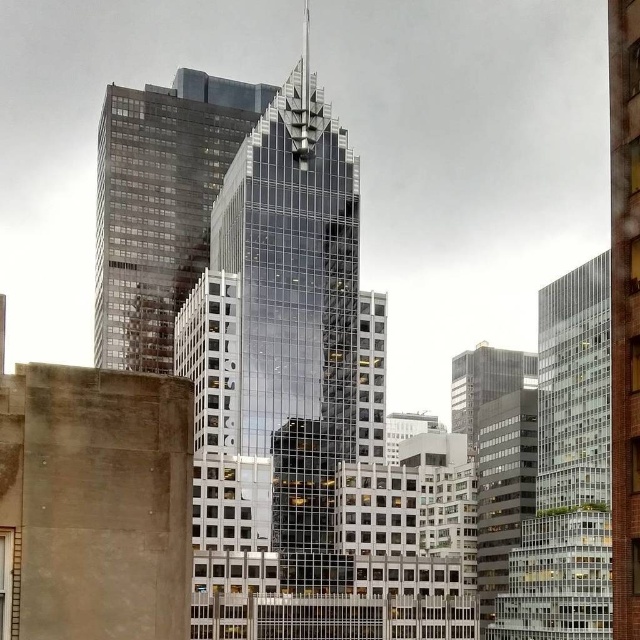
Question: From the image, what is the correct spatial relationship of glassy reflective skyscraper at center in relation to matte glass skyscraper at center?

Choices:
 (A) right
 (B) left

Answer: (B)

Question: Which of the following is the farthest from the observer?

Choices:
 (A) glassy steel skyscraper at center
 (B) matte glass skyscraper at center
 (C) glassy reflective skyscraper at center
 (D) glassy reflective building at right

Answer: (B)

Question: Estimate the real-world distances between objects in this image. Which object is closer to the glassy reflective skyscraper at center?

Choices:
 (A) matte glass skyscraper at center
 (B) glassy reflective building at right

Answer: (B)

Question: From the image, what is the correct spatial relationship of glassy steel skyscraper at center in relation to matte glass skyscraper at center?

Choices:
 (A) below
 (B) above

Answer: (B)

Question: Is glassy steel skyscraper at center smaller than matte glass skyscraper at center?

Choices:
 (A) no
 (B) yes

Answer: (A)

Question: Which point is farther to the camera?

Choices:
 (A) (212, 163)
 (B) (577, 492)
 (C) (321, 164)
 (D) (477, 348)

Answer: (D)